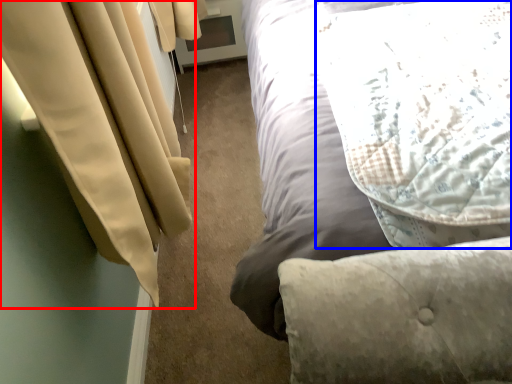
Question: Which object is further to the camera taking this photo, curtain (highlighted by a red box) or pillow (highlighted by a blue box)?

Choices:
 (A) curtain
 (B) pillow

Answer: (B)